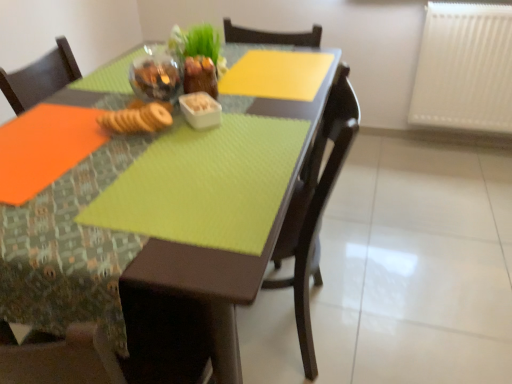
This screenshot has height=384, width=512. What are the coordinates of `matte brown chair at center` in the screenshot? It's located at (175, 335).

Considering the sizes of white plastic container at center, which is counted as the 2th tableware, starting from the left, and translucent glass bowl at upper center, the second tableware viewed from the right, in the image, is white plastic container at center, which is counted as the 2th tableware, starting from the left, wider or thinner than translucent glass bowl at upper center, the second tableware viewed from the right,?

white plastic container at center, which is counted as the 2th tableware, starting from the left, is thinner than translucent glass bowl at upper center, the second tableware viewed from the right.

Relative to translucent glass bowl at upper center, the second tableware viewed from the right, is white plastic container at center, the 1th tableware when ordered from right to left, in front or behind?

white plastic container at center, the 1th tableware when ordered from right to left, is in front of translucent glass bowl at upper center, the second tableware viewed from the right.

Which object is positioned more to the left, white plastic container at center, which is counted as the 2th tableware, starting from the left, or translucent glass bowl at upper center, acting as the 1th tableware starting from the left?

From the viewer's perspective, translucent glass bowl at upper center, acting as the 1th tableware starting from the left, appears more on the left side.

Is white plastic container at center, which is counted as the 2th tableware, starting from the left, next to translucent glass bowl at upper center, acting as the 1th tableware starting from the left?

No, white plastic container at center, which is counted as the 2th tableware, starting from the left, is not in contact with translucent glass bowl at upper center, acting as the 1th tableware starting from the left.

From a real-world perspective, between matte brown chair at center and brown crumbly biscuit at center, who is vertically higher?

In real-world perspective, brown crumbly biscuit at center is above.

Is the surface of matte brown chair at center in direct contact with brown crumbly biscuit at center?

matte brown chair at center and brown crumbly biscuit at center are not in contact.

Is matte brown chair at center facing towards brown crumbly biscuit at center?

Yes, matte brown chair at center is turned towards brown crumbly biscuit at center.

Between matte brown chair at center and brown crumbly biscuit at center, which one appears on the left side from the viewer's perspective?

Positioned to the left is brown crumbly biscuit at center.

Is translucent glass bowl at upper center, acting as the 1th tableware starting from the left, at the right side of matte brown chair at center?

No, translucent glass bowl at upper center, acting as the 1th tableware starting from the left, is not to the right of matte brown chair at center.

Is point (166, 67) closer to camera compared to point (217, 358)?

No, (166, 67) is further to viewer.

Between translucent glass bowl at upper center, the second tableware viewed from the right, and matte brown chair at center, which one has larger size?

matte brown chair at center is bigger.

From a real-world perspective, which object stands above the other?

translucent glass bowl at upper center, acting as the 1th tableware starting from the left, is physically above.

Can you confirm if white plastic radiator at upper right is taller than matte brown chair at center?

No.

Considering the relative positions of white plastic radiator at upper right and matte brown chair at center in the image provided, is white plastic radiator at upper right to the left of matte brown chair at center from the viewer's perspective?

No, white plastic radiator at upper right is not to the left of matte brown chair at center.

Locate an element on the screen. radiator behind the matte brown chair at center is located at coordinates (464, 68).

Is white plastic radiator at upper right with matte brown chair at center?

No, white plastic radiator at upper right is not in contact with matte brown chair at center.

Which of these two, brown crumbly biscuit at center or translucent glass bowl at upper center, acting as the 1th tableware starting from the left, is wider?

Wider between the two is brown crumbly biscuit at center.

Considering the relative sizes of brown crumbly biscuit at center and translucent glass bowl at upper center, the second tableware viewed from the right, in the image provided, is brown crumbly biscuit at center shorter than translucent glass bowl at upper center, the second tableware viewed from the right,?

Correct, brown crumbly biscuit at center is not as tall as translucent glass bowl at upper center, the second tableware viewed from the right.

This screenshot has width=512, height=384. What are the coordinates of `tableware above the brown crumbly biscuit at center (from a real-world perspective)` in the screenshot? It's located at (156, 75).

Does point (159, 129) lie behind point (152, 71)?

No, (159, 129) is in front of (152, 71).

Looking at this image, how different are the orientations of translucent glass bowl at upper center, acting as the 1th tableware starting from the left, and white plastic radiator at upper right in degrees?

There is a 100-degree angle between the facing directions of translucent glass bowl at upper center, acting as the 1th tableware starting from the left, and white plastic radiator at upper right.

From a real-world perspective, count 2nd tablewares upward from the white plastic radiator at upper right and point to it. Please provide its 2D coordinates.

[(156, 75)]

Is white plastic radiator at upper right a part of translucent glass bowl at upper center, the second tableware viewed from the right?

No, white plastic radiator at upper right is not a part of translucent glass bowl at upper center, the second tableware viewed from the right.

From the image's perspective, is translucent glass bowl at upper center, the second tableware viewed from the right, above or below white plastic radiator at upper right?

translucent glass bowl at upper center, the second tableware viewed from the right, is situated lower than white plastic radiator at upper right in the image.

From a real-world perspective, between white plastic container at center, the 1th tableware when ordered from right to left, and white plastic radiator at upper right, who is vertically lower?

In real-world perspective, white plastic radiator at upper right is lower.

Would you say white plastic container at center, which is counted as the 2th tableware, starting from the left, contains white plastic radiator at upper right?

No, white plastic radiator at upper right is located outside of white plastic container at center, which is counted as the 2th tableware, starting from the left.

How far apart are white plastic container at center, which is counted as the 2th tableware, starting from the left, and white plastic radiator at upper right?

white plastic container at center, which is counted as the 2th tableware, starting from the left, is 1.69 meters away from white plastic radiator at upper right.

This screenshot has width=512, height=384. Identify the location of tableware lying below the translucent glass bowl at upper center, the second tableware viewed from the right (from the image's perspective). (200, 110).

Locate an element on the screen. food that appears above the matte brown chair at center (from a real-world perspective) is located at coordinates 138,118.

Looking at the image, which one is located closer to brown crumbly biscuit at center, translucent glass bowl at upper center, the second tableware viewed from the right, or white plastic container at center, the 1th tableware when ordered from right to left?

Among the two, white plastic container at center, the 1th tableware when ordered from right to left, is located nearer to brown crumbly biscuit at center.

Looking at the image, which one is located closer to translucent glass bowl at upper center, the second tableware viewed from the right, matte brown chair at center or brown crumbly biscuit at center?

Among the two, brown crumbly biscuit at center is located nearer to translucent glass bowl at upper center, the second tableware viewed from the right.

Looking at the image, which one is located closer to white plastic container at center, the 1th tableware when ordered from right to left, brown crumbly biscuit at center or white plastic radiator at upper right?

The object closer to white plastic container at center, the 1th tableware when ordered from right to left, is brown crumbly biscuit at center.

Which object lies nearer to the anchor point brown crumbly biscuit at center, white plastic radiator at upper right or matte brown chair at center?

matte brown chair at center.

Which object lies further to the anchor point white plastic radiator at upper right, white plastic container at center, the 1th tableware when ordered from right to left, or translucent glass bowl at upper center, acting as the 1th tableware starting from the left?

white plastic container at center, the 1th tableware when ordered from right to left, lies further to white plastic radiator at upper right than the other object.

From the image, which object appears to be nearer to translucent glass bowl at upper center, the second tableware viewed from the right, matte brown chair at center or white plastic radiator at upper right?

Among the two, matte brown chair at center is located nearer to translucent glass bowl at upper center, the second tableware viewed from the right.

From the image, which object appears to be nearer to white plastic radiator at upper right, matte brown chair at center or translucent glass bowl at upper center, the second tableware viewed from the right?

The object closer to white plastic radiator at upper right is matte brown chair at center.

From the image, which object appears to be farther from white plastic radiator at upper right, brown crumbly biscuit at center or white plastic container at center, which is counted as the 2th tableware, starting from the left?

The object further to white plastic radiator at upper right is brown crumbly biscuit at center.

Identify the location of tableware situated between translucent glass bowl at upper center, acting as the 1th tableware starting from the left, and white plastic radiator at upper right from left to right. (200, 110).

Image resolution: width=512 pixels, height=384 pixels. I want to click on chair between white plastic container at center, which is counted as the 2th tableware, starting from the left, and white plastic radiator at upper right, so click(175, 335).

The width and height of the screenshot is (512, 384). In order to click on tableware that lies between translucent glass bowl at upper center, acting as the 1th tableware starting from the left, and matte brown chair at center from top to bottom in this screenshot , I will do `click(200, 110)`.

This screenshot has width=512, height=384. Find the location of `tableware between brown crumbly biscuit at center and white plastic container at center, which is counted as the 2th tableware, starting from the left, from left to right`. tableware between brown crumbly biscuit at center and white plastic container at center, which is counted as the 2th tableware, starting from the left, from left to right is located at coordinates (156, 75).